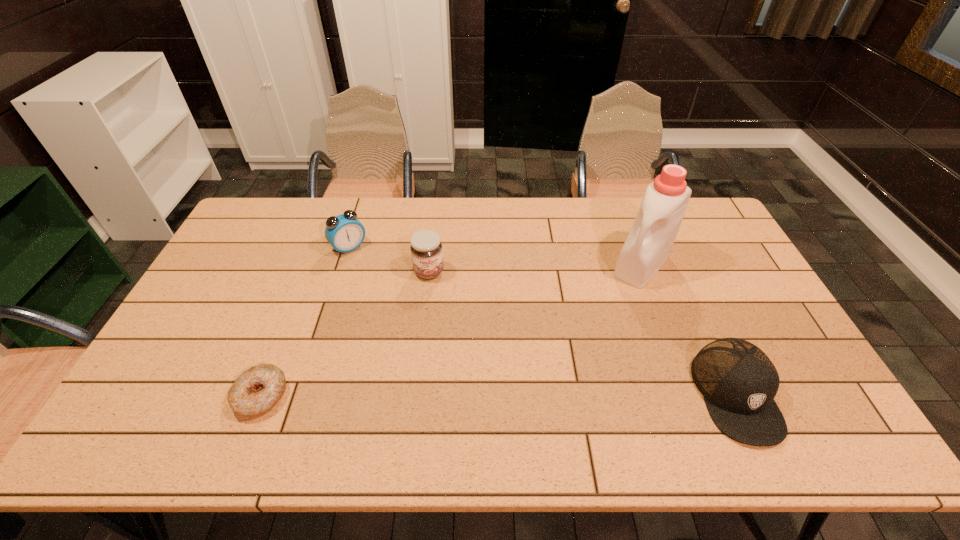
Find the location of a particular element. This screenshot has height=540, width=960. doughnut is located at coordinates (258, 389).

The height and width of the screenshot is (540, 960). Identify the location of cap. (738, 381).

This screenshot has width=960, height=540. In order to click on the third object from right to left in this screenshot , I will do `click(426, 247)`.

In order to click on alarm clock in this screenshot , I will do `click(344, 232)`.

At what (x,y) coordinates should I click in order to perform the action: click on detergent. Please return your answer as a coordinate pair (x, y). The image size is (960, 540). Looking at the image, I should click on (662, 209).

Where is `vacant space located 0.320m on the back of the shortest object`? vacant space located 0.320m on the back of the shortest object is located at coordinates (305, 284).

You are a GUI agent. You are given a task and a screenshot of the screen. Output one action in this format:
    pyautogui.click(x=<x>, y=<y>)
    Task: Click on the vacant position located 0.220m on the front label of the jam
    Image resolution: width=960 pixels, height=540 pixels.
    Given the screenshot: What is the action you would take?
    pyautogui.click(x=451, y=336)

Locate an element on the screen. Image resolution: width=960 pixels, height=540 pixels. free space located on the front label of the jam is located at coordinates (449, 330).

This screenshot has height=540, width=960. In order to click on free location located on the front label of the jam in this screenshot , I will do `click(444, 313)`.

The width and height of the screenshot is (960, 540). What are the coordinates of `free point located on the face of the alarm clock` in the screenshot? It's located at (403, 308).